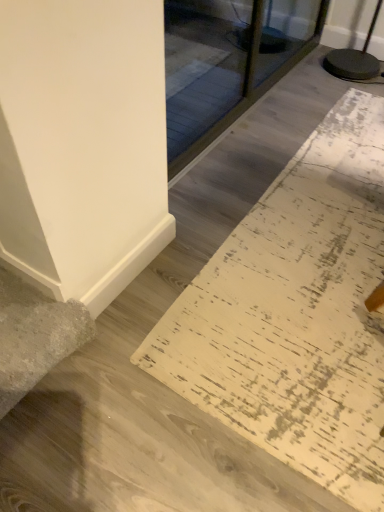
Question: Considering the relative sizes of white distressed rug at lower right and transparent glass door at upper center in the image provided, is white distressed rug at lower right smaller than transparent glass door at upper center?

Choices:
 (A) no
 (B) yes

Answer: (B)

Question: Considering the relative positions of white distressed rug at lower right and transparent glass door at upper center in the image provided, is white distressed rug at lower right to the left of transparent glass door at upper center from the viewer's perspective?

Choices:
 (A) no
 (B) yes

Answer: (A)

Question: Considering the relative sizes of white distressed rug at lower right and transparent glass door at upper center in the image provided, is white distressed rug at lower right shorter than transparent glass door at upper center?

Choices:
 (A) yes
 (B) no

Answer: (A)

Question: Is the depth of white distressed rug at lower right greater than that of transparent glass door at upper center?

Choices:
 (A) yes
 (B) no

Answer: (B)

Question: Is transparent glass door at upper center located within white distressed rug at lower right?

Choices:
 (A) yes
 (B) no

Answer: (B)

Question: Does white distressed rug at lower right come in front of transparent glass door at upper center?

Choices:
 (A) yes
 (B) no

Answer: (A)

Question: Would you consider transparent glass door at upper center to be distant from white distressed rug at lower right?

Choices:
 (A) yes
 (B) no

Answer: (A)

Question: From a real-world perspective, is transparent glass door at upper center located beneath white distressed rug at lower right?

Choices:
 (A) no
 (B) yes

Answer: (A)

Question: Considering the relative positions of transparent glass door at upper center and white distressed rug at lower right in the image provided, is transparent glass door at upper center to the right of white distressed rug at lower right from the viewer's perspective?

Choices:
 (A) no
 (B) yes

Answer: (A)

Question: Can you confirm if transparent glass door at upper center is positioned to the left of white distressed rug at lower right?

Choices:
 (A) yes
 (B) no

Answer: (A)

Question: Is transparent glass door at upper center bigger than white distressed rug at lower right?

Choices:
 (A) yes
 (B) no

Answer: (A)

Question: Does transparent glass door at upper center have a smaller size compared to white distressed rug at lower right?

Choices:
 (A) yes
 (B) no

Answer: (B)

Question: In terms of height, does transparent glass door at upper center look taller or shorter compared to white distressed rug at lower right?

Choices:
 (A) short
 (B) tall

Answer: (B)